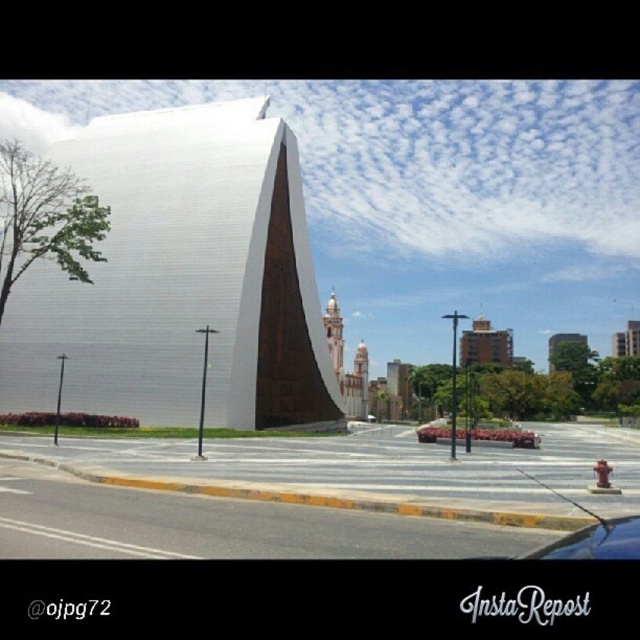
Does shiny black car at lower right appear over green textured tree at upper center?

Correct, shiny black car at lower right is located above green textured tree at upper center.

Does shiny black car at lower right have a lesser width compared to green textured tree at upper center?

Yes, shiny black car at lower right is thinner than green textured tree at upper center.

Between point (609, 541) and point (577, 333), which one is positioned behind?

Positioned behind is point (577, 333).

Find the location of `shiny black car at lower right`. shiny black car at lower right is located at coordinates (595, 541).

Is point (193, 304) more distant than point (627, 336)?

No, it is in front of (627, 336).

Can you confirm if white matte building at center is wider than white concrete building at upper right?

Indeed, white matte building at center has a greater width compared to white concrete building at upper right.

Does point (284, 260) lie behind point (628, 324)?

No, (284, 260) is closer to viewer.

At what (x,y) coordinates should I click in order to perform the action: click on white matte building at center. Please return your answer as a coordinate pair (x, y). The height and width of the screenshot is (640, 640). Looking at the image, I should click on (180, 280).

Is white matte building at center shorter than brown brick building at center?

No, white matte building at center is not shorter than brown brick building at center.

Which of these two, white matte building at center or brown brick building at center, stands shorter?

brown brick building at center

The width and height of the screenshot is (640, 640). What are the coordinates of `white matte building at center` in the screenshot? It's located at (180, 280).

Where is `white matte building at center`? white matte building at center is located at coordinates (180, 280).